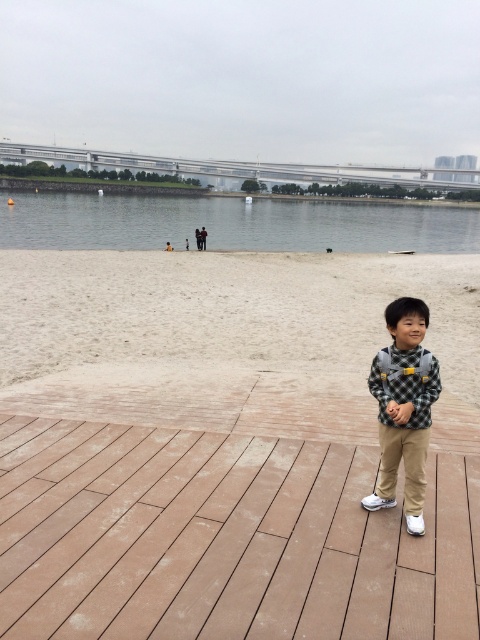
In the scene shown: You are a parent looking at the waterfront scene. You see a child wearing a checkered fabric shirt at center and standing near clear water at lower center. Based on their positions, is the child closer to the water or the deck?

The clear water at lower center is positioned on the left side of checkered fabric shirt at center. Since the child is wearing the checkered fabric shirt at center, the child is closer to the deck than the water.

You are a photographer setting up a tripod to capture the brown wood deck at center and the checkered fabric shirt at center in the same frame. Based on their heights, which object should you focus on first to ensure both are in focus?

The brown wood deck at center has a lesser height compared to checkered fabric shirt at center, so you should focus on the checkered fabric shirt at center first to ensure both are in focus.

You are standing on the wooden deck and see the point marked at coordinates (232, 224). Is that point on the wooden deck or in the water?

The point marked at coordinates (232, 224) is on clear water at lower center, so it is in the water.